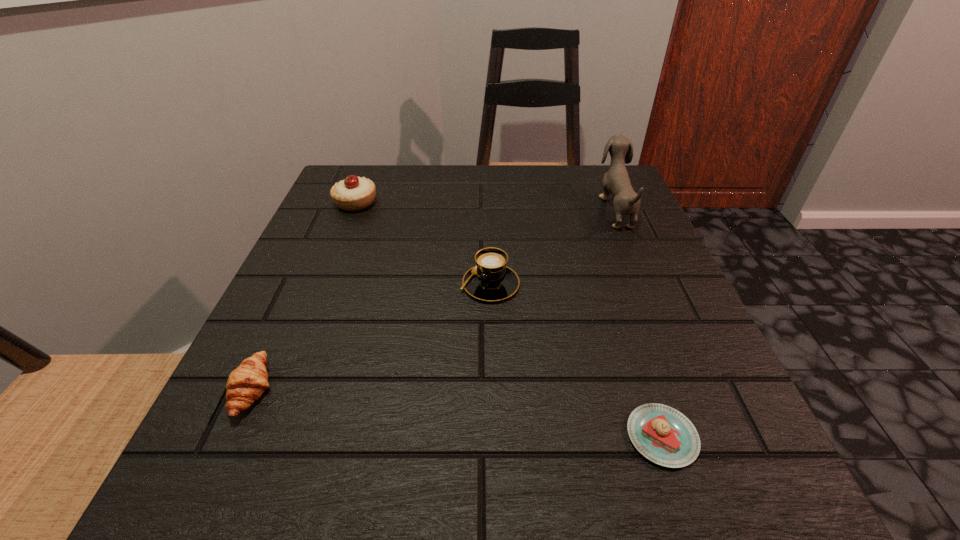
This screenshot has height=540, width=960. Find the location of `free space located at the face of the tallest object`. free space located at the face of the tallest object is located at coordinates (483, 208).

At what (x,y) coordinates should I click in order to perform the action: click on vacant point located on the right of the fourth shortest object. Please return your answer as a coordinate pair (x, y). The width and height of the screenshot is (960, 540). Looking at the image, I should click on (533, 202).

Where is `vacant region located on the front of the third farthest object`? This screenshot has height=540, width=960. vacant region located on the front of the third farthest object is located at coordinates (492, 331).

You are a GUI agent. You are given a task and a screenshot of the screen. Output one action in this format:
    pyautogui.click(x=<x>, y=<y>)
    Task: Click on the free region located on the front-facing side of the fourth tallest object
    
    Given the screenshot: What is the action you would take?
    pyautogui.click(x=492, y=390)

This screenshot has height=540, width=960. What are the coordinates of `free space located on the left of the shortest object` in the screenshot? It's located at (418, 437).

Find the location of `puppy situated at the far edge`. puppy situated at the far edge is located at coordinates (616, 181).

This screenshot has height=540, width=960. Find the location of `pastry located in the far edge section of the desktop`. pastry located in the far edge section of the desktop is located at coordinates (354, 193).

This screenshot has height=540, width=960. What are the coordinates of `object that is positioned at the near edge` in the screenshot? It's located at (662, 434).

The height and width of the screenshot is (540, 960). I want to click on puppy positioned at the right edge, so click(x=616, y=181).

The height and width of the screenshot is (540, 960). What are the coordinates of `pastry at the right edge` in the screenshot? It's located at (662, 434).